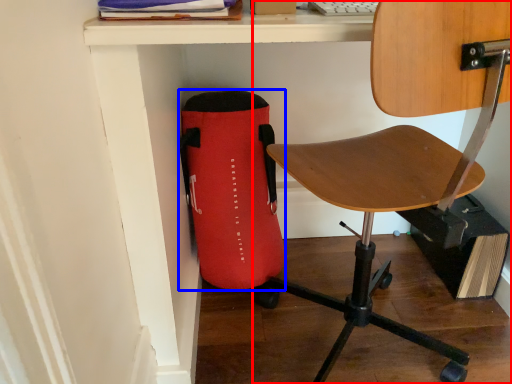
Question: Which object appears farthest to the camera in this image, chair (highlighted by a red box) or bag (highlighted by a blue box)?

Choices:
 (A) chair
 (B) bag

Answer: (B)